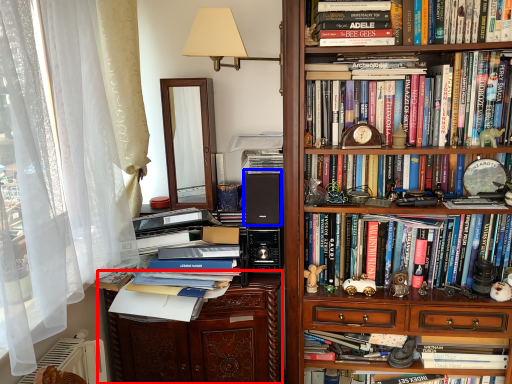
Question: Which of the following is the farthest to the observer, file cabinet (highlighted by a red box) or speaker (highlighted by a blue box)?

Choices:
 (A) file cabinet
 (B) speaker

Answer: (B)